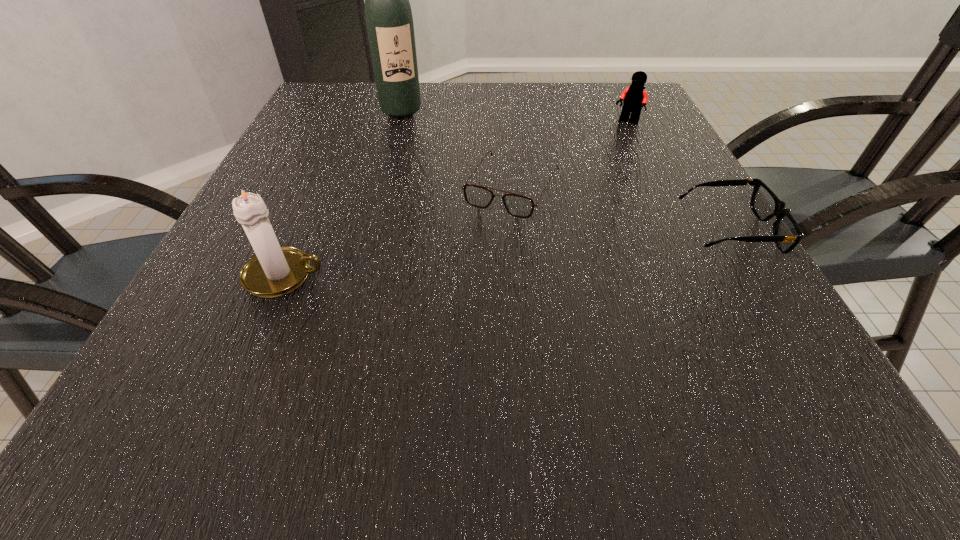
Identify the location of vacant point located between the leftmost object and the third object from right to left. The image size is (960, 540). (398, 232).

You are a GUI agent. You are given a task and a screenshot of the screen. Output one action in this format:
    pyautogui.click(x=<x>, y=<y>)
    Task: Click on the free spot between the left sunglasses and the right sunglasses
    
    Given the screenshot: What is the action you would take?
    pyautogui.click(x=621, y=210)

Find the location of a particular element. free space between the fourth shortest object and the tallest object is located at coordinates (343, 193).

You are a GUI agent. You are given a task and a screenshot of the screen. Output one action in this format:
    pyautogui.click(x=<x>, y=<y>)
    Task: Click on the unoccupied area between the right sunglasses and the tallest object
    The height and width of the screenshot is (540, 960).
    Given the screenshot: What is the action you would take?
    pyautogui.click(x=565, y=171)

Locate an element on the screen. vacant space that's between the third object from right to left and the right sunglasses is located at coordinates (621, 210).

This screenshot has width=960, height=540. What are the coordinates of `free spot between the wine bottle and the Lego` in the screenshot? It's located at (x=514, y=117).

The width and height of the screenshot is (960, 540). Find the location of `vacant area that lies between the third tallest object and the candle holder`. vacant area that lies between the third tallest object and the candle holder is located at coordinates (456, 199).

This screenshot has height=540, width=960. Find the location of `empty space between the second object from left to right and the second tallest object`. empty space between the second object from left to right and the second tallest object is located at coordinates (343, 193).

Choose which object is the fourth nearest neighbor to the wine bottle. Please provide its 2D coordinates. Your answer should be formatted as a tuple, i.e. [(x, y)], where the tuple contains the x and y coordinates of a point satisfying the conditions above.

[(787, 234)]

Identify the location of the second closest object to the right sunglasses. The width and height of the screenshot is (960, 540). (634, 96).